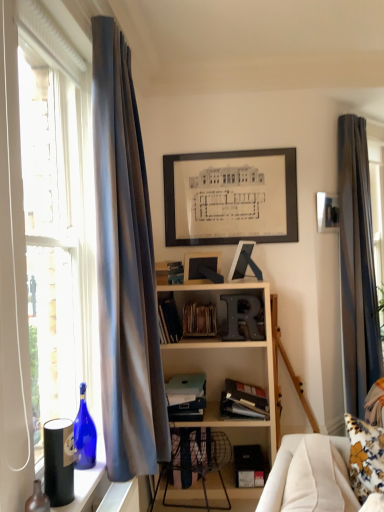
Locate an element on the screen. free space above silky blue curtain at right, which is the 2th curtain from front to back (from a real-world perspective) is located at coordinates (360, 105).